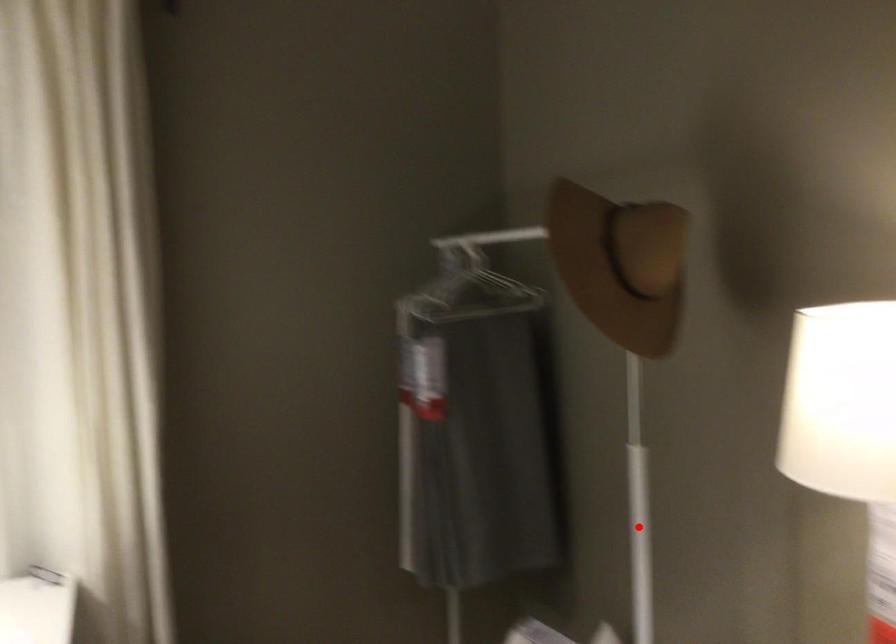
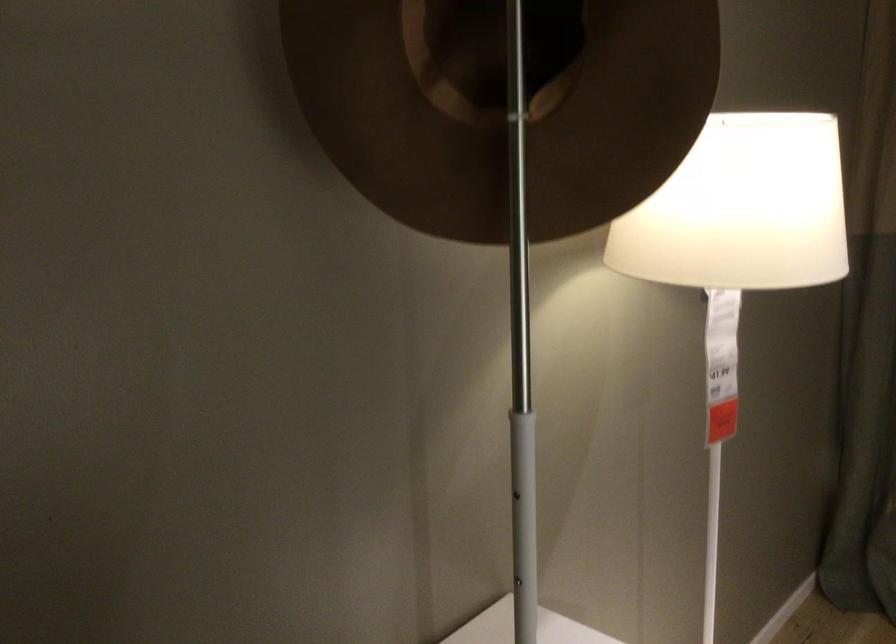
Question: I am providing you with two images of the same scene from different viewpoints. A red point is shown in image1. For the corresponding object point in image2, is it positioned nearer or farther from the camera?

Choices:
 (A) Nearer
 (B) Farther

Answer: (A)